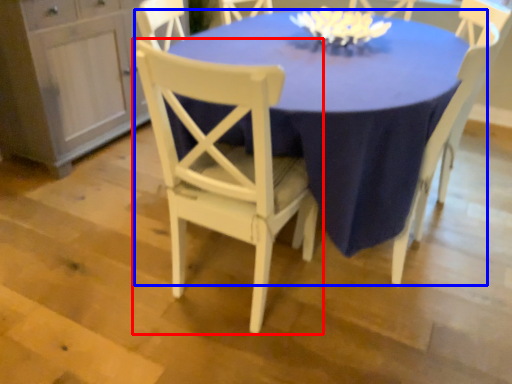
Question: Among these objects, which one is farthest to the camera, chair (highlighted by a red box) or table (highlighted by a blue box)?

Choices:
 (A) chair
 (B) table

Answer: (B)